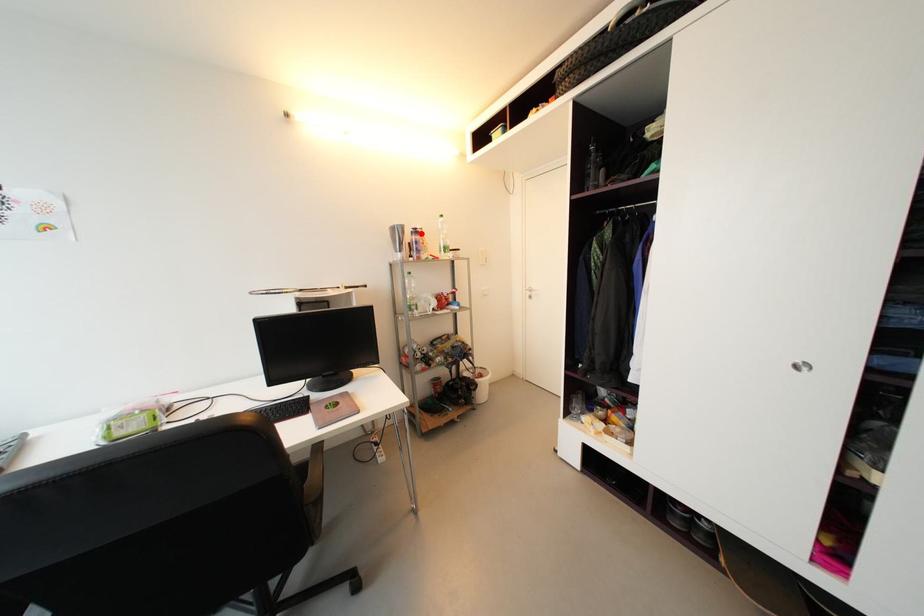
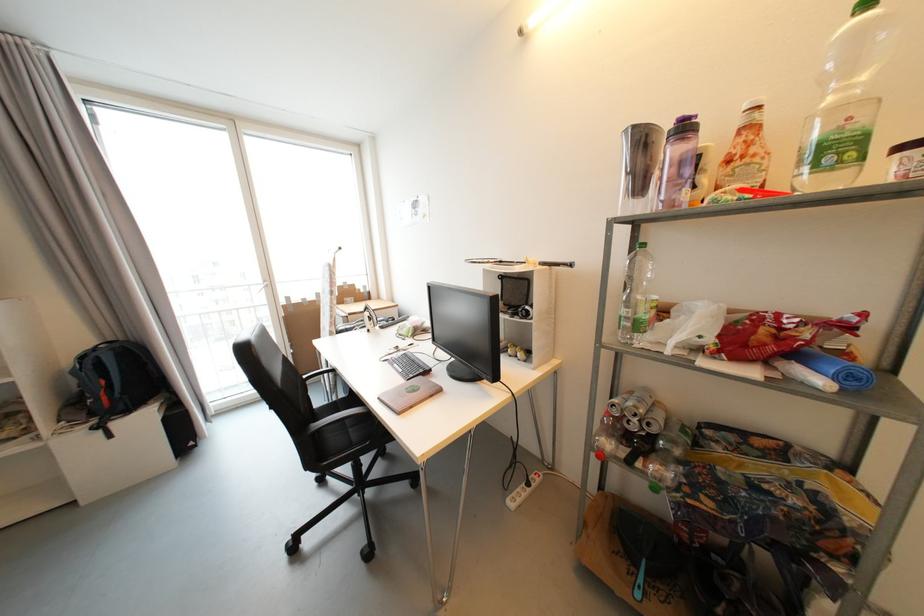
Find the pixel in the second image that matches the highlighted location in the first image.

(689, 130)